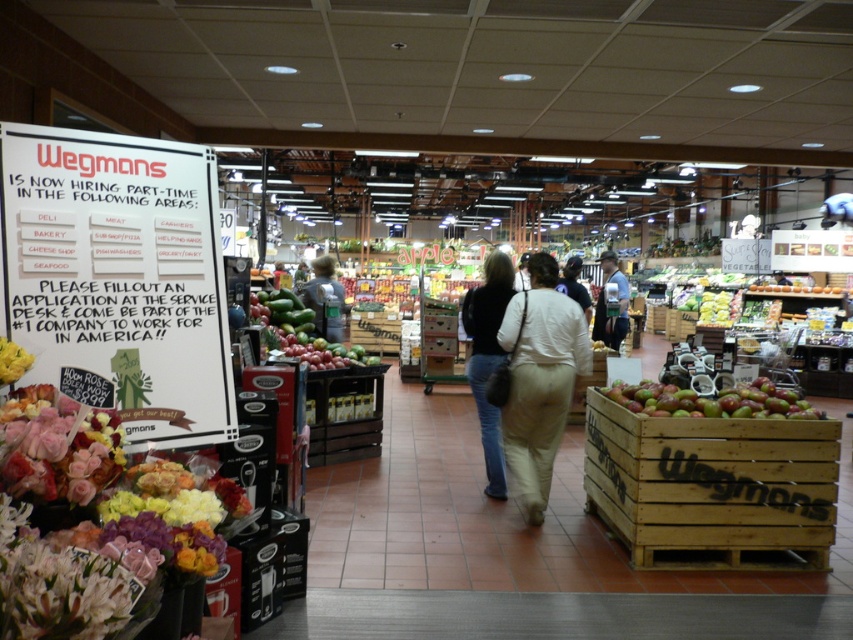
Describe the element at coordinates (492, 518) in the screenshot. I see `wooden crate of apples at center` at that location.

Does wooden crate of apples at center come in front of denim jacket at center?

That is True.

Which is in front, point (366, 465) or point (328, 273)?

Point (366, 465) is in front.

The height and width of the screenshot is (640, 853). I want to click on wooden crate of apples at center, so click(492, 518).

Can you confirm if denim jacket at center is wider than light beige pants at center?

Incorrect, denim jacket at center's width does not surpass light beige pants at center's.

Does denim jacket at center appear under light beige pants at center?

Indeed, denim jacket at center is positioned under light beige pants at center.

Is point (321, 256) in front of point (573, 298)?

No, (321, 256) is behind (573, 298).

In order to click on denim jacket at center in this screenshot , I will do `click(323, 298)`.

Does wooden crate of apples at center appear on the right side of green matte apples at center-right?

No, wooden crate of apples at center is not to the right of green matte apples at center-right.

Who is more distant from viewer, (602, 534) or (659, 401)?

The point (602, 534) is behind.

At what (x,y) coordinates should I click in order to perform the action: click on wooden crate of apples at center. Please return your answer as a coordinate pair (x, y). The width and height of the screenshot is (853, 640). Looking at the image, I should click on (492, 518).